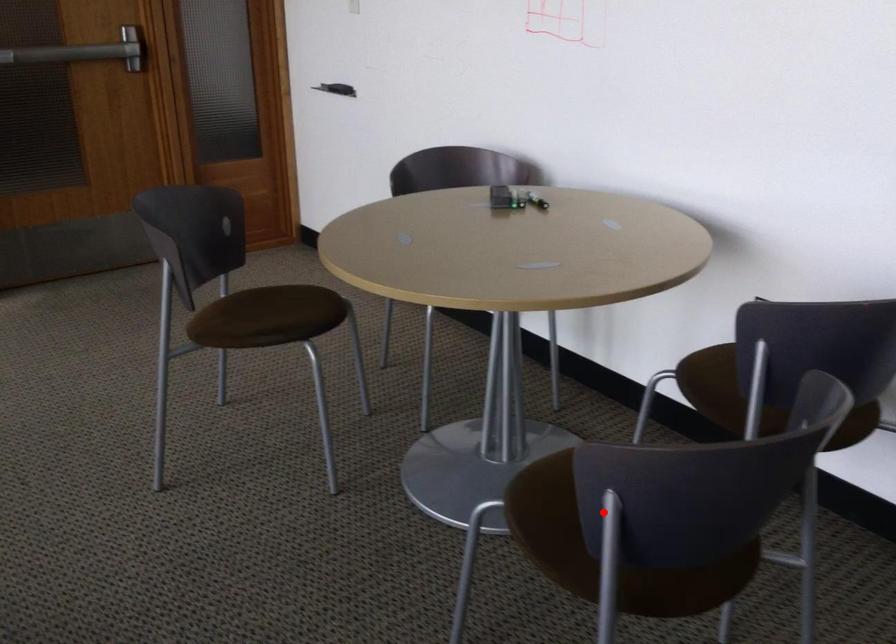
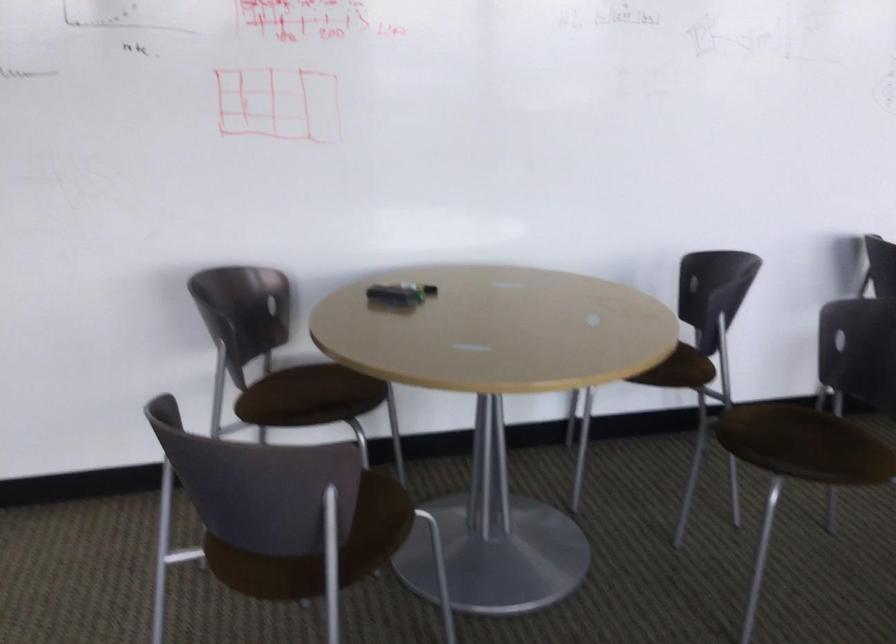
Question: A red point is marked in image1. In image2, is the corresponding 3D point closer to the camera or farther? Reply with the corresponding letter.

Choices:
 (A) The corresponding 3D point is closer.
 (B) The corresponding 3D point is farther.

Answer: (B)